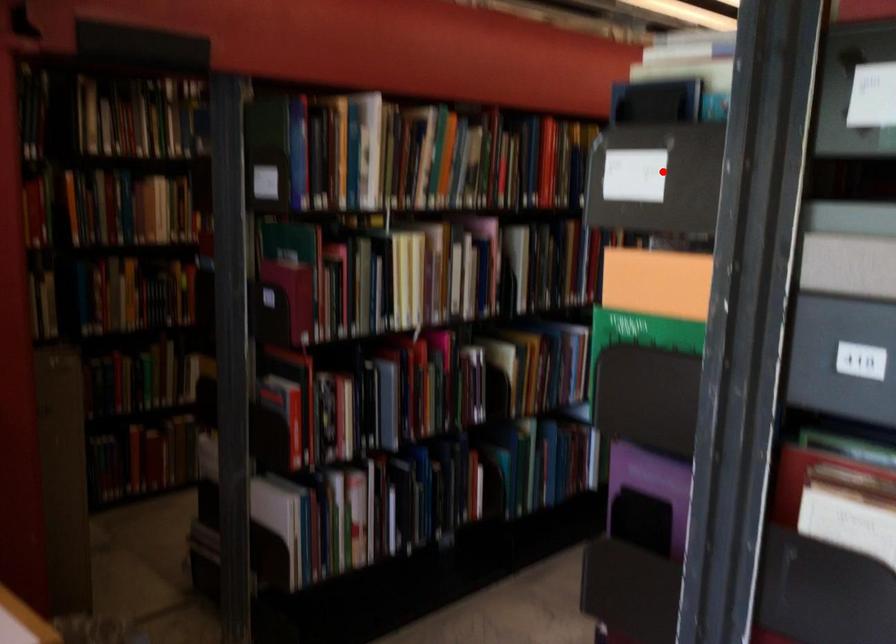
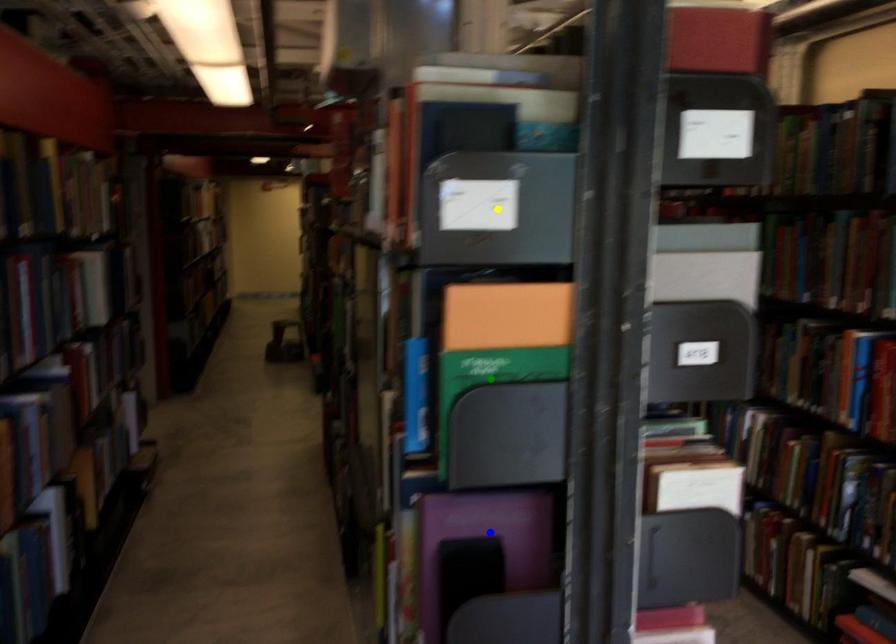
Question: I am providing you with two images of the same scene from different viewpoints. A red point is marked on the first image. You are given multiple points on the second image. Can you choose the point in image 2 that corresponds to the point in image 1?

Choices:
 (A) yellow point
 (B) green point
 (C) blue point

Answer: (A)